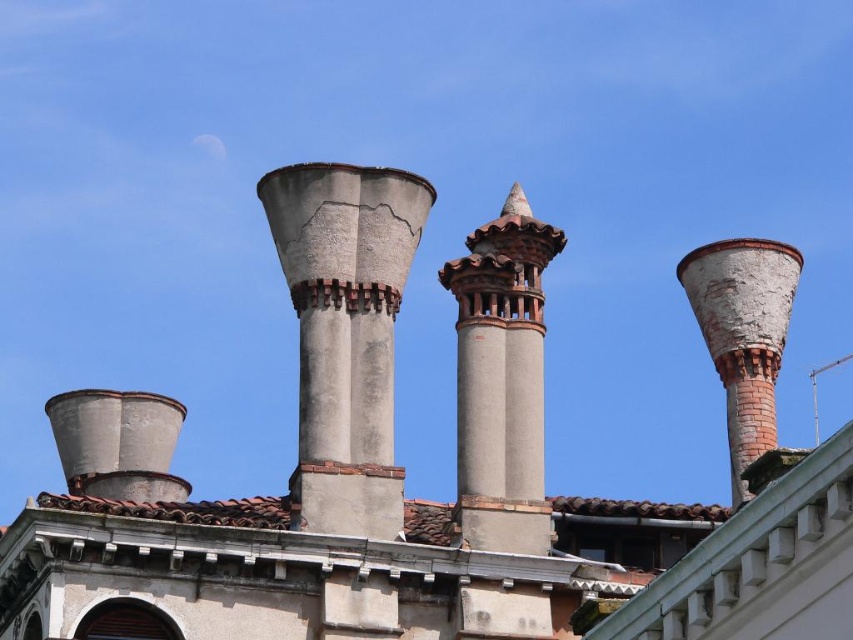
Question: Can you confirm if gray concrete chimney at center is positioned below white brick chimney at right?

Choices:
 (A) no
 (B) yes

Answer: (B)

Question: Which object is farther from the camera taking this photo?

Choices:
 (A) gray concrete chimney at center
 (B) terracotta textured chimney at center

Answer: (B)

Question: Is gray concrete chimney at center smaller than terracotta textured chimney at center?

Choices:
 (A) yes
 (B) no

Answer: (B)

Question: Among these points, which one is nearest to the camera?

Choices:
 (A) (717, 369)
 (B) (477, 413)

Answer: (B)

Question: Can you confirm if terracotta textured chimney at center is thinner than white brick chimney at right?

Choices:
 (A) no
 (B) yes

Answer: (B)

Question: Which object appears farthest from the camera in this image?

Choices:
 (A) white brick chimney at right
 (B) gray concrete chimney at center

Answer: (A)